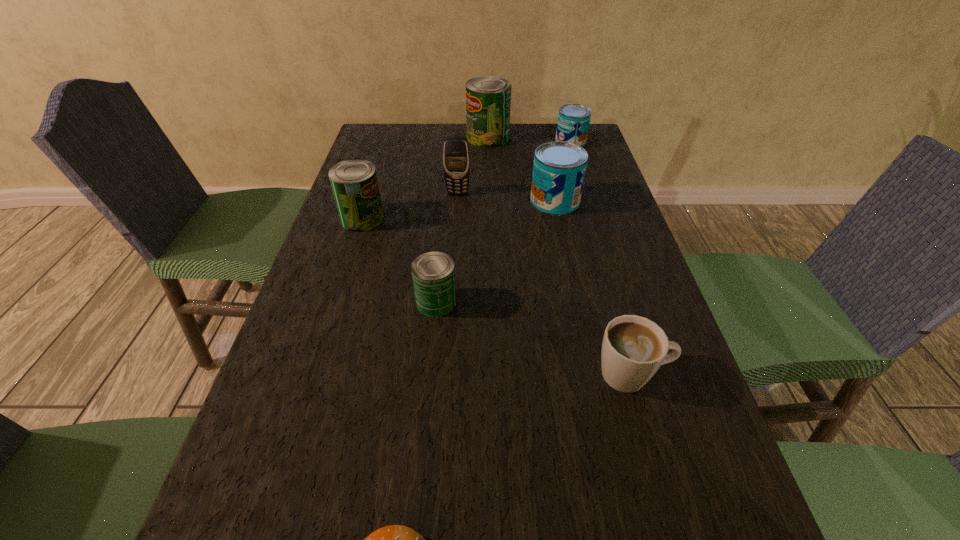
Find the location of `white cappuccino`. white cappuccino is located at coordinates (633, 349).

Find the location of a particular element. The width and height of the screenshot is (960, 540). vacant space located 0.320m on the left of the biggest green can is located at coordinates 372,138.

This screenshot has height=540, width=960. I want to click on vacant position located on the front face of the cellular telephone, so click(x=455, y=232).

The width and height of the screenshot is (960, 540). In order to click on vacant space located 0.390m on the front of the nearer blue can in this screenshot , I will do `click(583, 330)`.

Find the location of a particular element. This screenshot has width=960, height=540. vacant space situated on the back of the second farthest green can is located at coordinates (378, 168).

At what (x,y) coordinates should I click in order to perform the action: click on free space located 0.260m on the front of the smaller blue can. Please return your answer as a coordinate pair (x, y). Looking at the image, I should click on tap(587, 194).

In order to click on vacant space situated 0.310m on the back of the smallest green can in this screenshot , I will do point(445,207).

This screenshot has height=540, width=960. I want to click on object present at the left edge, so click(354, 182).

Locate an element on the screen. This screenshot has height=540, width=960. cappuccino that is at the right edge is located at coordinates (633, 349).

At what (x,y) coordinates should I click in order to perform the action: click on object present at the far right corner. Please return your answer as a coordinate pair (x, y). Looking at the image, I should click on [573, 122].